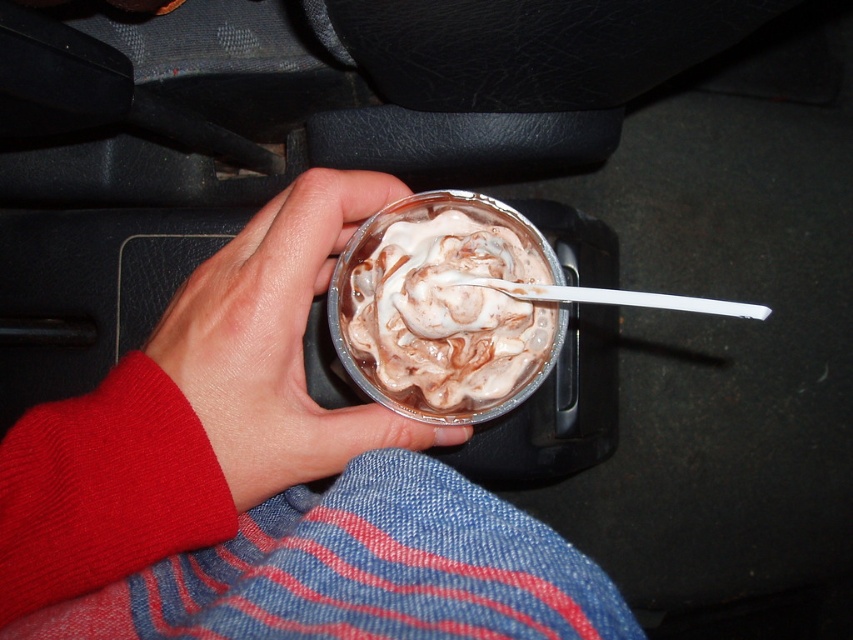
Question: Is smooth skin hand at center positioned before chocolate frosted cupcake at center?

Choices:
 (A) no
 (B) yes

Answer: (B)

Question: Which object is farther from the camera taking this photo?

Choices:
 (A) chocolate frosted cupcake at center
 (B) smooth skin hand at center

Answer: (A)

Question: Which point is closer to the camera?

Choices:
 (A) chocolate frosted cupcake at center
 (B) smooth skin hand at center

Answer: (B)

Question: Is smooth skin hand at center to the left of chocolate frosted cupcake at center from the viewer's perspective?

Choices:
 (A) no
 (B) yes

Answer: (B)

Question: Which point is closer to the camera?

Choices:
 (A) smooth skin hand at center
 (B) chocolate frosted cupcake at center

Answer: (A)

Question: Considering the relative positions of smooth skin hand at center and chocolate frosted cupcake at center in the image provided, where is smooth skin hand at center located with respect to chocolate frosted cupcake at center?

Choices:
 (A) below
 (B) above

Answer: (A)